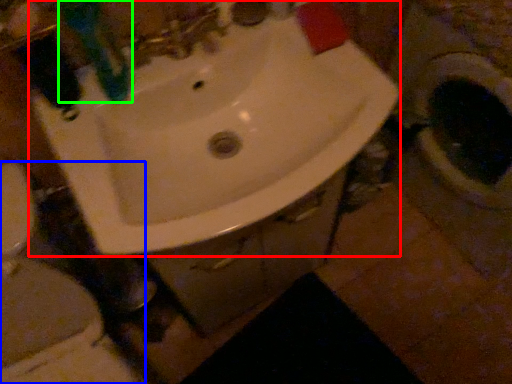
Question: Based on their relative distances, which object is farther from sink (highlighted by a red box)? Choose from toilet (highlighted by a blue box) and toothbrush (highlighted by a green box).

Choices:
 (A) toilet
 (B) toothbrush

Answer: (A)